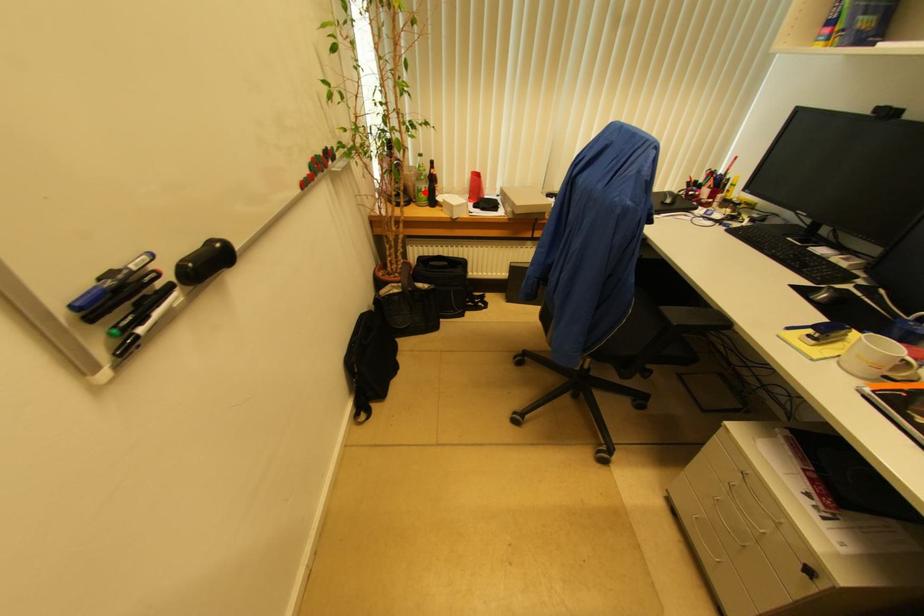
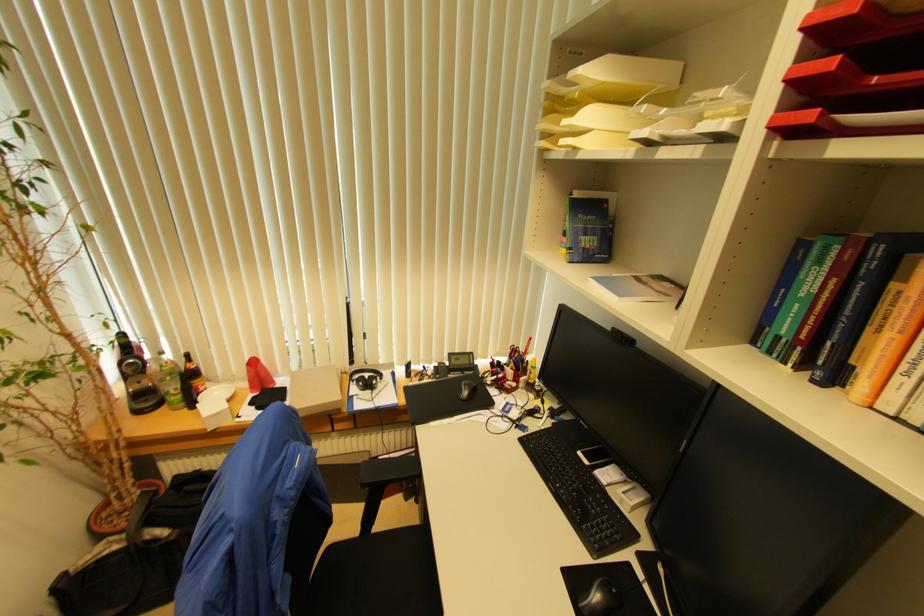
Question: I am providing you with two images of the same scene from different viewpoints. Image1 has a red point marked. In image2, the corresponding 3D location appears at what relative position? Reply with the corresponding letter.

Choices:
 (A) Closer
 (B) Farther

Answer: (B)